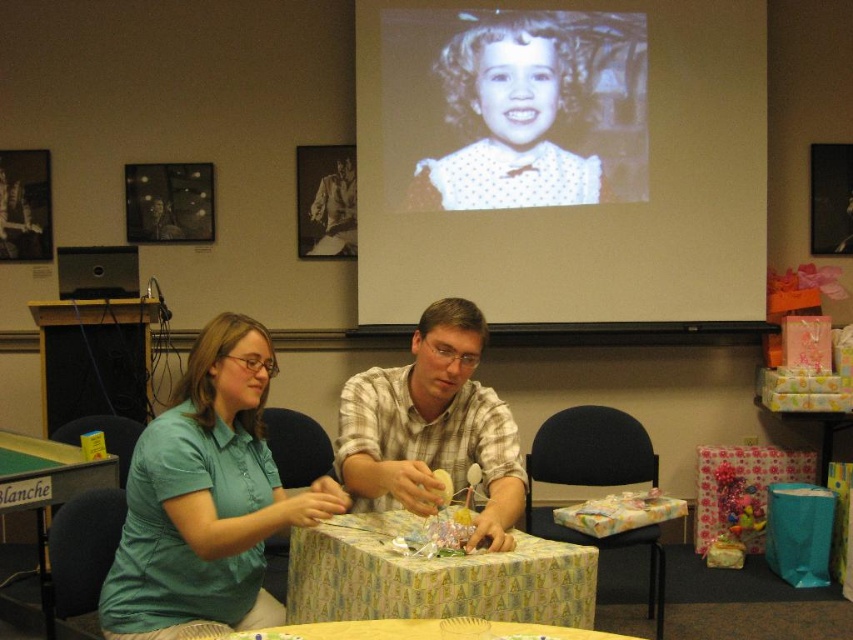
Question: Which point is closer to the camera taking this photo?

Choices:
 (A) (393, 451)
 (B) (245, 323)
 (C) (471, 636)

Answer: (C)

Question: Is teal shirt at center positioned in front of patterned paper table at center?

Choices:
 (A) yes
 (B) no

Answer: (B)

Question: Which object is closer to the camera taking this photo?

Choices:
 (A) teal shirt at center
 (B) white dotted dress at upper center

Answer: (A)

Question: Is white dotted dress at upper center thinner than patterned paper table at center?

Choices:
 (A) yes
 (B) no

Answer: (B)

Question: Which point is closer to the camera taking this photo?

Choices:
 (A) (415, 436)
 (B) (567, 108)
 (C) (41, 609)

Answer: (A)

Question: Does patterned paper table at center have a smaller size compared to green fabric table at lower left?

Choices:
 (A) no
 (B) yes

Answer: (B)